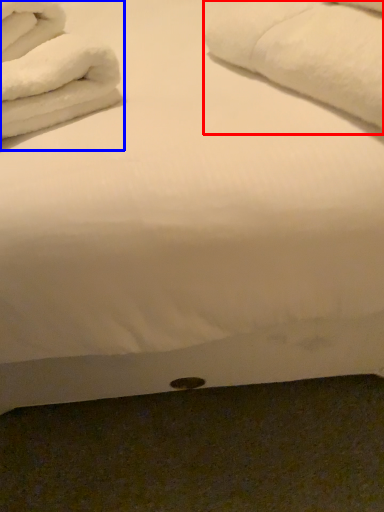
Question: Which of the following is the farthest to the observer, bath towel (highlighted by a red box) or bath towel (highlighted by a blue box)?

Choices:
 (A) bath towel
 (B) bath towel

Answer: (B)